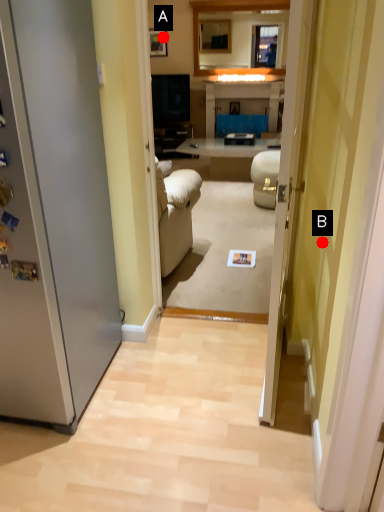
Question: Two points are circled on the image, labeled by A and B beside each circle. Which of the following is the closest to the observer?

Choices:
 (A) A is closer
 (B) B is closer

Answer: (B)